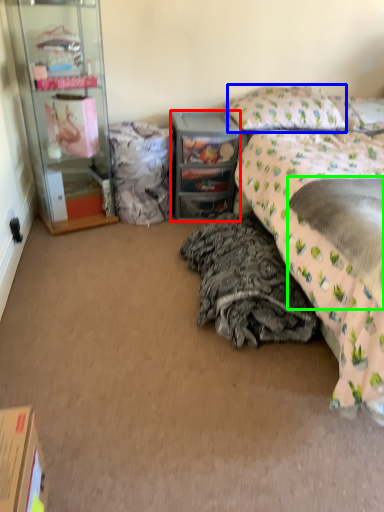
Question: Based on their relative distances, which object is nearer to desk (highlighted by a red box)? Choose from pillow (highlighted by a blue box) and sheet (highlighted by a green box).

Choices:
 (A) pillow
 (B) sheet

Answer: (A)